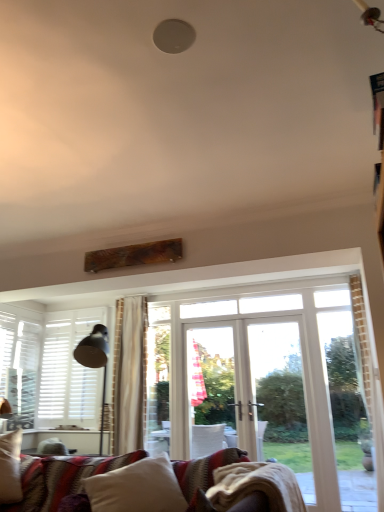
At what (x,y) coordinates should I click in order to perform the action: click on white matte shutters at left. Please return your answer as a coordinate pair (x, y). This screenshot has width=384, height=512. Looking at the image, I should click on (19, 366).

What do you see at coordinates (19, 366) in the screenshot?
I see `white matte shutters at left` at bounding box center [19, 366].

This screenshot has height=512, width=384. I want to click on white soft pillow at lower center, so click(x=137, y=488).

Describe the element at coordinates (137, 488) in the screenshot. I see `white soft pillow at lower center` at that location.

Image resolution: width=384 pixels, height=512 pixels. I want to click on white matte shutters at left, so click(19, 366).

Between white matte shutters at left and white soft pillow at lower center, which one appears on the left side from the viewer's perspective?

white matte shutters at left is more to the left.

Which object is closer to the camera, white matte shutters at left or white soft pillow at lower center?

white soft pillow at lower center.

Considering the positions of point (30, 336) and point (161, 488), is point (30, 336) closer or farther from the camera than point (161, 488)?

Point (30, 336).

From the image's perspective, does white matte shutters at left appear lower than white soft pillow at lower center?

Incorrect, from the image's perspective, white matte shutters at left is higher than white soft pillow at lower center.

From a real-world perspective, is white matte shutters at left on white soft pillow at lower center?

Correct, in the physical world, white matte shutters at left is higher than white soft pillow at lower center.

Considering the relative sizes of white matte shutters at left and white soft pillow at lower center in the image provided, is white matte shutters at left wider than white soft pillow at lower center?

No.

Looking at this image, between white matte shutters at left and white soft pillow at lower center, which one has more height?

white matte shutters at left is taller.

Considering the sizes of objects white matte shutters at left and white soft pillow at lower center in the image provided, who is bigger, white matte shutters at left or white soft pillow at lower center?

white soft pillow at lower center is bigger.

Based on the photo, does white matte shutters at left contain white soft pillow at lower center?

That's incorrect, white soft pillow at lower center is not inside white matte shutters at left.

Is white matte shutters at left next to white soft pillow at lower center?

white matte shutters at left and white soft pillow at lower center are clearly separated.

In the scene shown: Is white matte shutters at left positioned with its back to white soft pillow at lower center?

white matte shutters at left is not turned away from white soft pillow at lower center.

What's the angular difference between white matte shutters at left and white soft pillow at lower center's facing directions?

66.7 degrees separate the facing orientations of white matte shutters at left and white soft pillow at lower center.

Where is `window on the left of white soft pillow at lower center`? This screenshot has width=384, height=512. window on the left of white soft pillow at lower center is located at coordinates (19, 366).

Considering the relative positions of white soft pillow at lower center and white matte shutters at left in the image provided, is white soft pillow at lower center to the left of white matte shutters at left from the viewer's perspective?

No, white soft pillow at lower center is not to the left of white matte shutters at left.

In the image, is white soft pillow at lower center positioned in front of or behind white matte shutters at left?

Visually, white soft pillow at lower center is located in front of white matte shutters at left.

Between point (140, 469) and point (1, 342), which one is positioned in front?

Point (140, 469)

From the image's perspective, relative to white matte shutters at left, is white soft pillow at lower center above or below?

Clearly, from the image's perspective, white soft pillow at lower center is below white matte shutters at left.

Looking at this image, from a real-world perspective, is white soft pillow at lower center positioned under white matte shutters at left based on gravity?

Correct, in the physical world, white soft pillow at lower center is lower than white matte shutters at left.

Which object is thinner, white soft pillow at lower center or white matte shutters at left?

Thinner between the two is white matte shutters at left.

Is white soft pillow at lower center taller than white matte shutters at left?

In fact, white soft pillow at lower center may be shorter than white matte shutters at left.

Is white soft pillow at lower center smaller than white matte shutters at left?

No, white soft pillow at lower center is not smaller than white matte shutters at left.

Choose the correct answer: Is white soft pillow at lower center inside white matte shutters at left or outside it?

white soft pillow at lower center is not inside white matte shutters at left, it's outside.

Are white soft pillow at lower center and white matte shutters at left located far from each other?

Yes, white soft pillow at lower center and white matte shutters at left are located far from each other.

Is white soft pillow at lower center turned away from white matte shutters at left?

That's not correct — white soft pillow at lower center is not looking away from white matte shutters at left.

This screenshot has width=384, height=512. What are the coordinates of `pillow below the white matte shutters at left (from a real-world perspective)` in the screenshot? It's located at (x=137, y=488).

You are a GUI agent. You are given a task and a screenshot of the screen. Output one action in this format:
    pyautogui.click(x=<x>, y=<y>)
    Task: Click on the window that appears above the white soft pillow at lower center (from the image's perspective)
    Image resolution: width=384 pixels, height=512 pixels.
    Given the screenshot: What is the action you would take?
    pyautogui.click(x=19, y=366)

You are a GUI agent. You are given a task and a screenshot of the screen. Output one action in this format:
    pyautogui.click(x=<x>, y=<y>)
    Task: Click on the window located on the left of white soft pillow at lower center
    The image size is (384, 512).
    Given the screenshot: What is the action you would take?
    pyautogui.click(x=19, y=366)